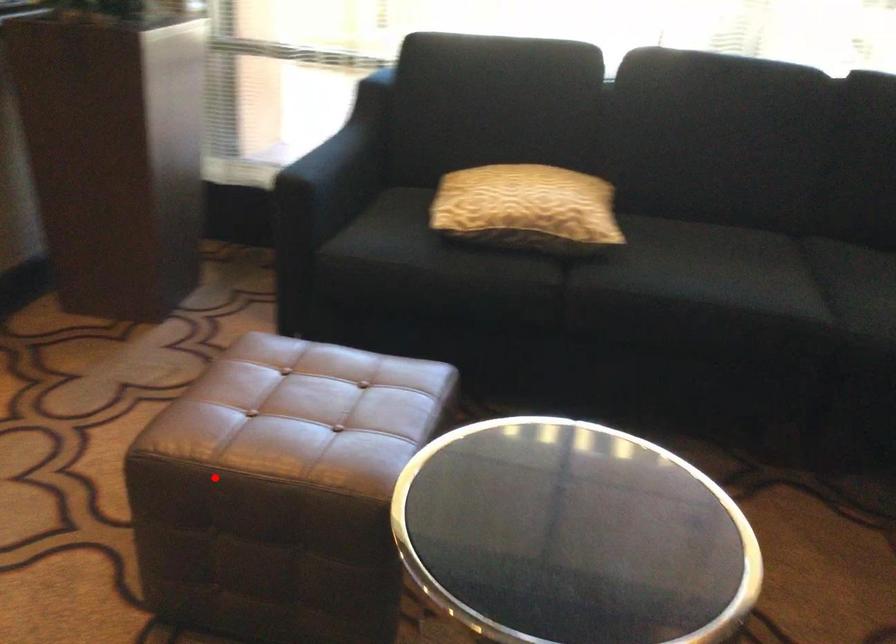
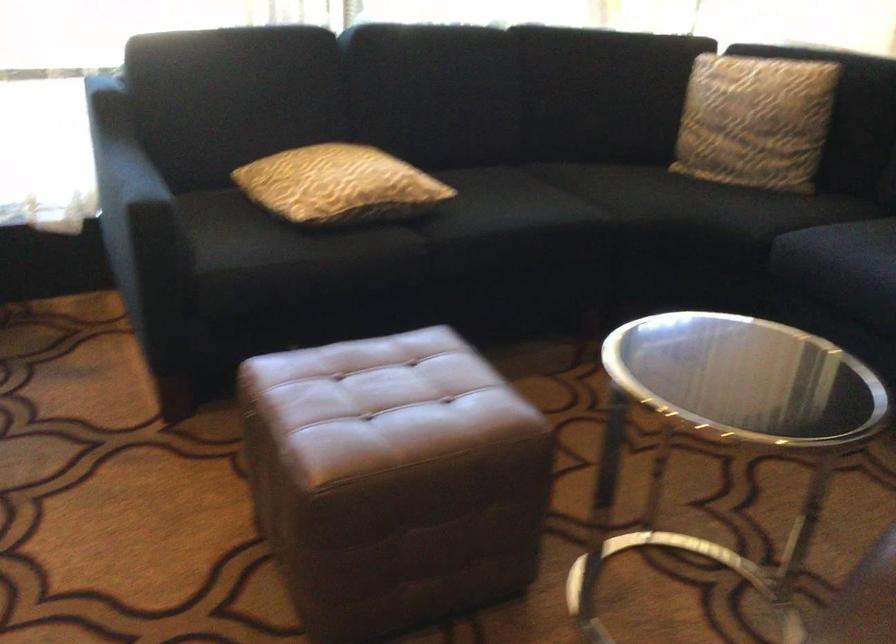
In the second image, find the point that corresponds to the highlighted location in the first image.

(392, 480)